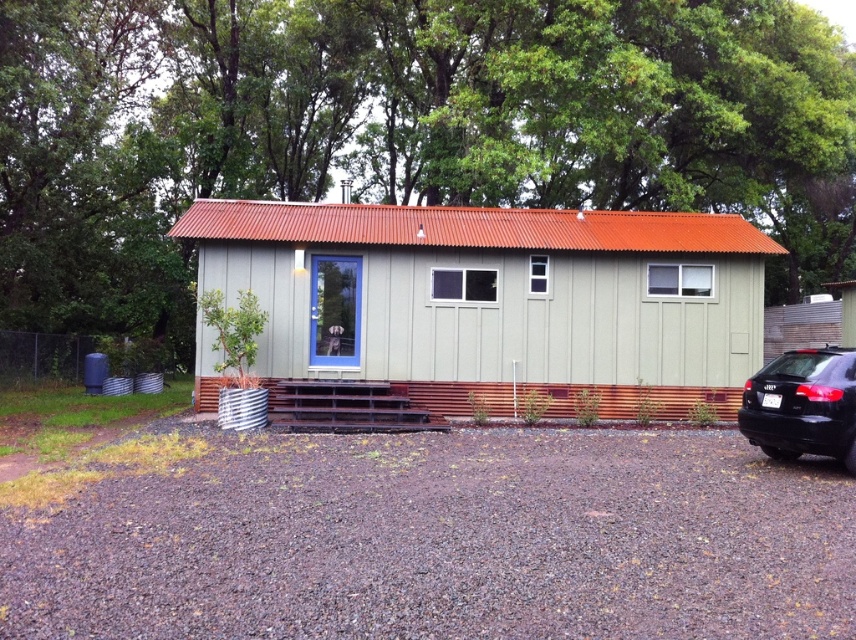
Does point (714, 358) come behind point (845, 364)?

That is True.

Is point (310, 300) positioned before point (801, 378)?

No.

Where is `green corrugated metal hut at center`? Image resolution: width=856 pixels, height=640 pixels. green corrugated metal hut at center is located at coordinates (496, 300).

Locate an element on the screen. This screenshot has height=640, width=856. green corrugated metal hut at center is located at coordinates (496, 300).

Is green leafy tree at upper center bigger than green corrugated metal hut at center?

Indeed, green leafy tree at upper center has a larger size compared to green corrugated metal hut at center.

Locate an element on the screen. This screenshot has height=640, width=856. green leafy tree at upper center is located at coordinates (401, 128).

Locate an element on the screen. Image resolution: width=856 pixels, height=640 pixels. green leafy tree at upper center is located at coordinates (401, 128).

Does green leafy tree at upper center have a lesser width compared to black glossy sedan at lower right?

No, green leafy tree at upper center is not thinner than black glossy sedan at lower right.

Where is `green leafy tree at upper center`? The width and height of the screenshot is (856, 640). green leafy tree at upper center is located at coordinates (401, 128).

Identify the location of green leafy tree at upper center. (401, 128).